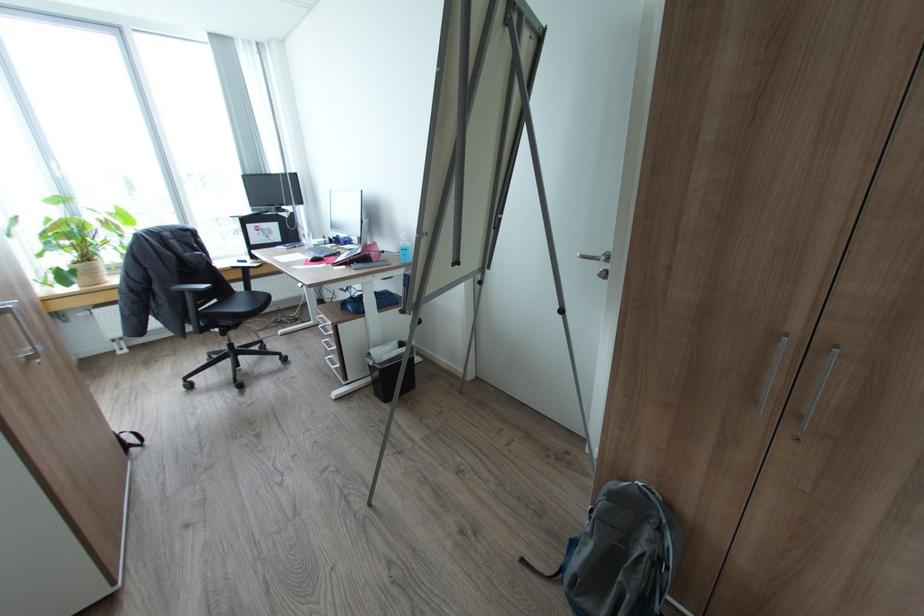
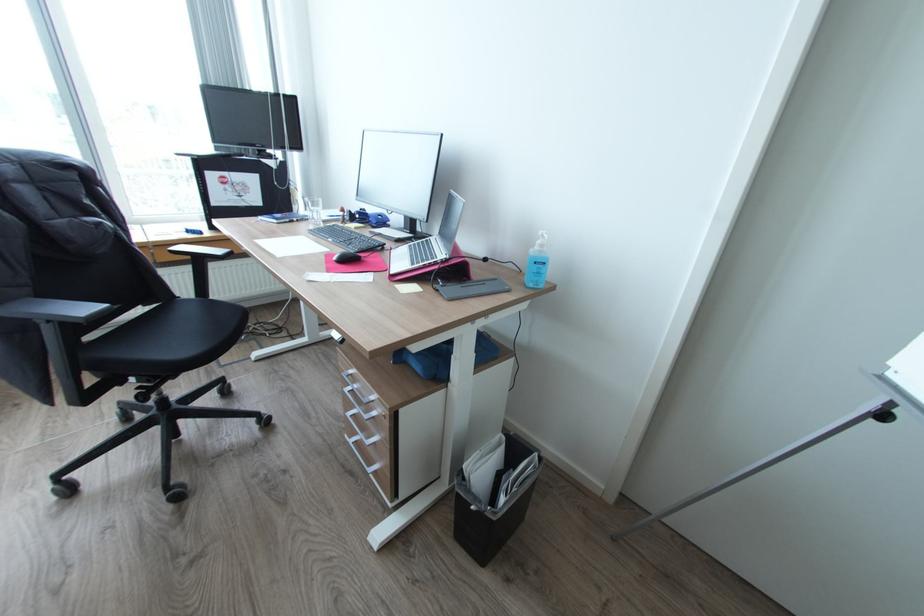
Find the pixel in the second image that matches point 314,259 in the first image.

(339, 257)